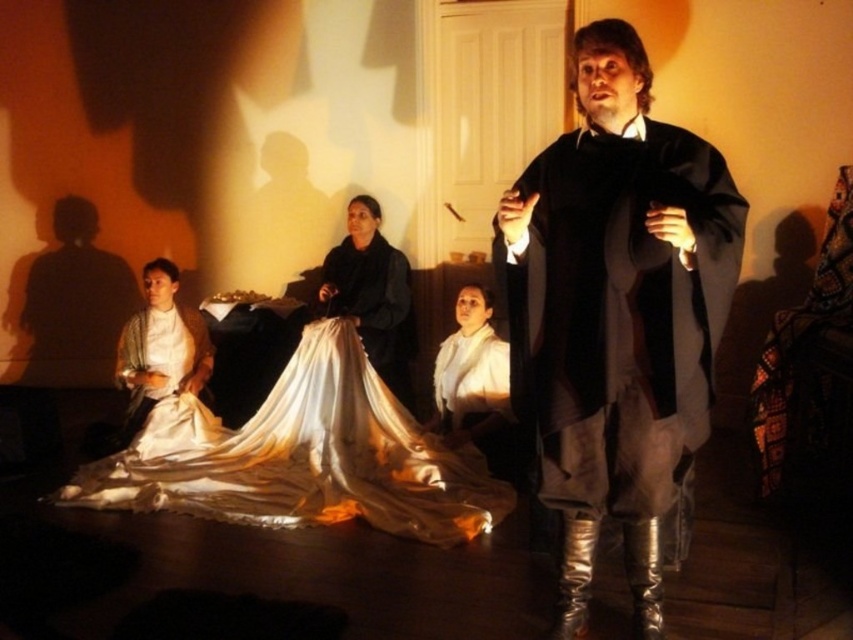
You are an actor in a play and need to position yourself at point (372, 294). Where should you stand to be on the silky white gown at center?

You should stand at point (372, 294) because that point is on the silky white gown at center.

You are an actor in a play and need to position yourself exactly at the center of the stage. The stage has a coordinate system where the bottom left corner is at point 0,0 and the top right corner is at point 1,1. You see the matte black robe at center. What coordinates should you aim for to stand precisely at the center of the stage?

The coordinates for the center of the stage are [426,320]. Since the matte black robe at center is located at point [616,314], you should move slightly to the right and down from the robe to reach the exact center at [616,320] and then adjust vertically to 0.5 on the y axis. However, since the stage center is [426,320], you need to position yourself at those coordinates, which are near the robe but slightly to the right and lower.

You are an event planner organizing a fashion show. You have two dresses to display on mannequins. The silky white gown at center and the white satin dress at center. Which dress should you choose if you want the one that takes up more space?

The silky white gown at center is larger in size than the white satin dress at center, so it takes up more space and should be chosen for the display.